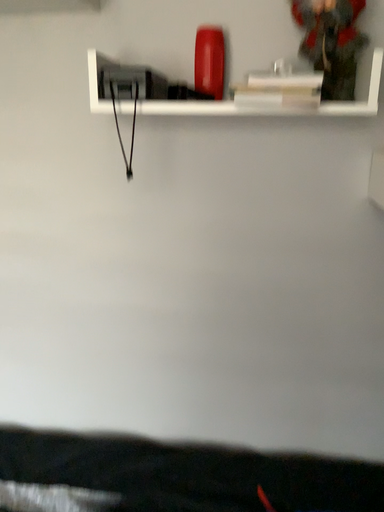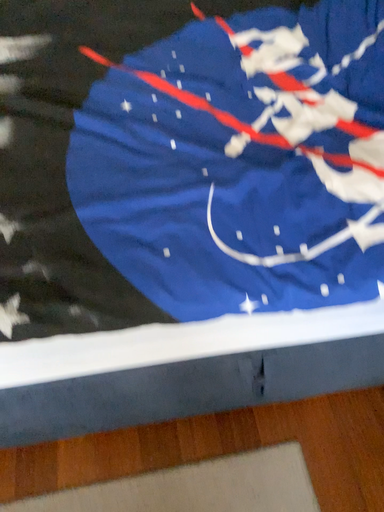
Question: Which way did the camera rotate in the video?

Choices:
 (A) rotated upward
 (B) rotated downward

Answer: (B)